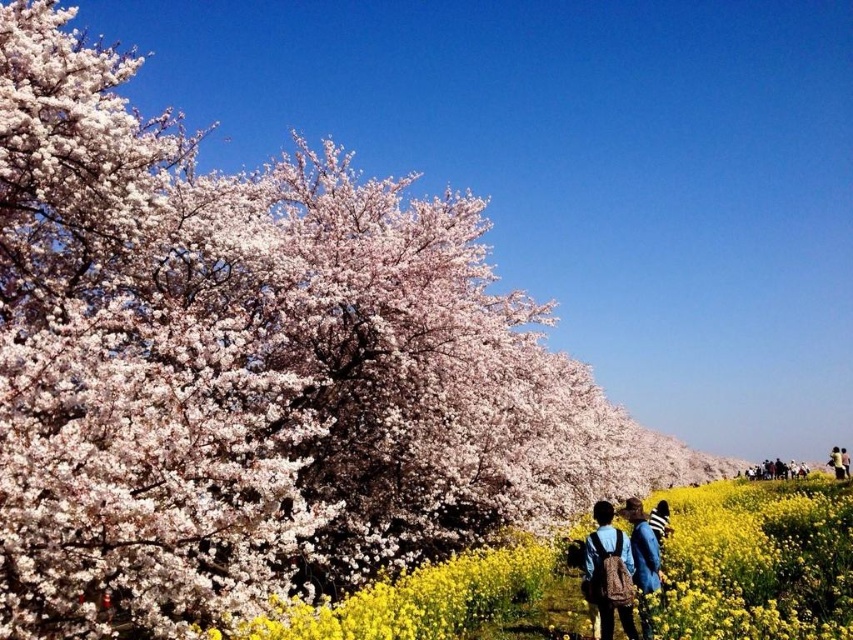
Question: Which of the following is the closest to the observer?

Choices:
 (A) white fluffy blossoms at center
 (B) blue denim jacket at lower right
 (C) blue fabric jacket at lower right
 (D) denim jacket at center

Answer: (A)

Question: Among these points, which one is farthest from the camera?

Choices:
 (A) (769, 470)
 (B) (593, 536)
 (C) (657, 564)
 (D) (350, 618)

Answer: (A)

Question: Does white fluffy blossoms at center appear under blue denim jacket at lower right?

Choices:
 (A) no
 (B) yes

Answer: (A)

Question: Among these objects, which one is nearest to the camera?

Choices:
 (A) denim jacket at center
 (B) blue denim jacket at lower right

Answer: (A)

Question: Can you confirm if denim jacket at center is positioned to the left of blue fabric jacket at lower right?

Choices:
 (A) yes
 (B) no

Answer: (A)

Question: Can you confirm if white fluffy blossoms at center is positioned below denim jacket at center?

Choices:
 (A) no
 (B) yes

Answer: (B)